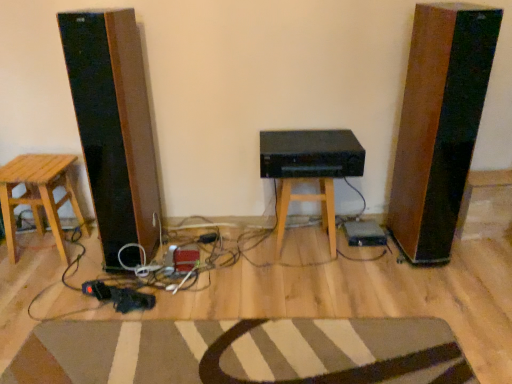
Where is `free space in front of wooden stool at center, the second stool when ordered from left to right`? free space in front of wooden stool at center, the second stool when ordered from left to right is located at coordinates (306, 278).